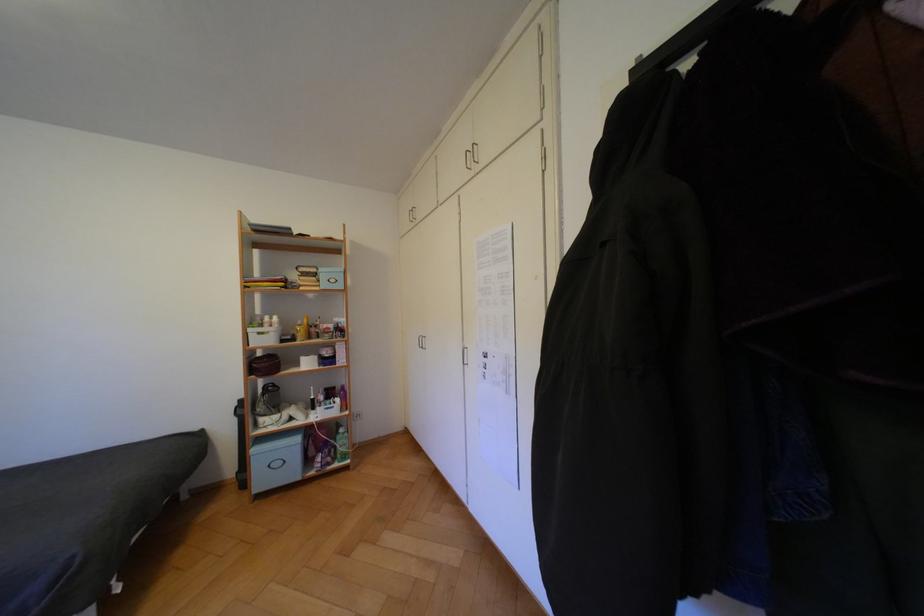
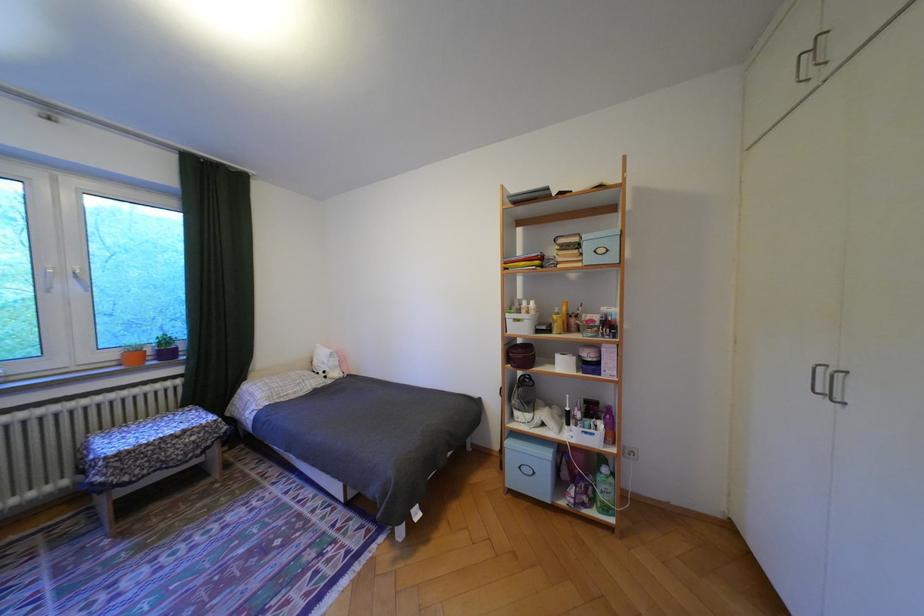
In the second image, find the point that corresponds to pixel 341 464 in the first image.

(596, 505)